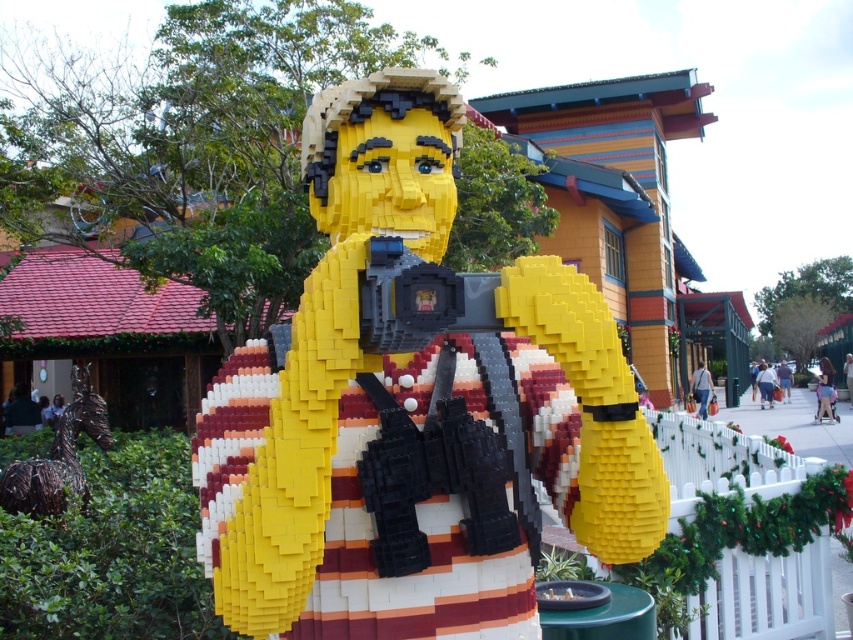
How far apart are yellow matte lego figure at center and bronze horse at lower left?

yellow matte lego figure at center is 5.04 meters from bronze horse at lower left.

Which is more to the left, yellow matte lego figure at center or bronze horse at lower left?

bronze horse at lower left

Who is more forward, (410, 250) or (54, 449)?

Point (410, 250) is in front.

Find the location of a particular element. Image resolution: width=853 pixels, height=640 pixels. yellow matte lego figure at center is located at coordinates (415, 406).